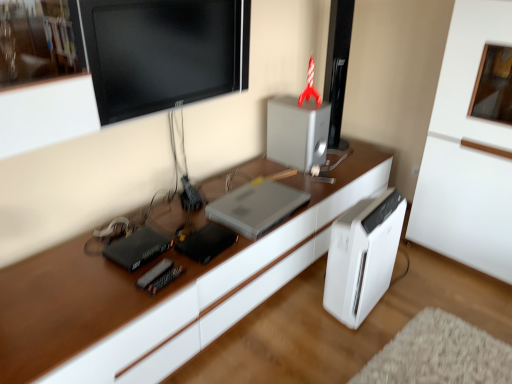
Locate an element on the screen. Image resolution: width=512 pixels, height=384 pixels. free point above black plastic router at left, placed as the 2th appliance when sorted from back to front (from a real-world perspective) is located at coordinates (136, 241).